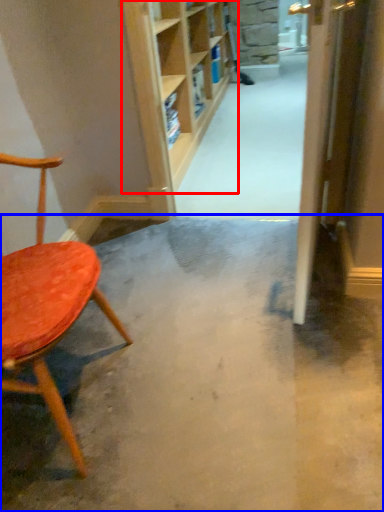
Question: Which object is closer to the camera taking this photo, shelf (highlighted by a red box) or concrete (highlighted by a blue box)?

Choices:
 (A) shelf
 (B) concrete

Answer: (B)